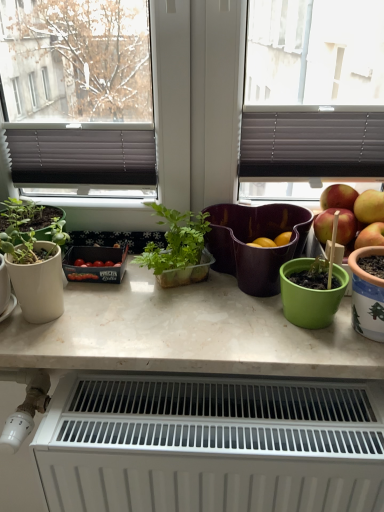
Locate an element on the screen. This screenshot has height=512, width=384. blank space situated above white marble countertop at center (from a real-world perspective) is located at coordinates (173, 307).